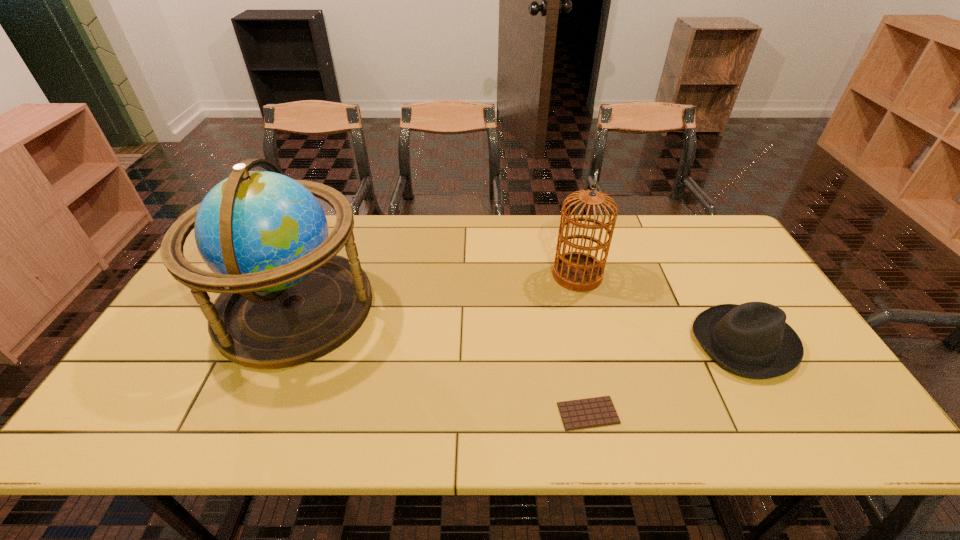
This screenshot has height=540, width=960. Identify the location of the leftmost object. (286, 298).

Locate an element on the screen. The width and height of the screenshot is (960, 540). the tallest object is located at coordinates (286, 298).

In order to click on the third shortest object in this screenshot , I will do `click(577, 271)`.

Identify the location of the third tallest object. This screenshot has height=540, width=960. (752, 339).

Locate an element on the screen. Image resolution: width=960 pixels, height=540 pixels. fedora is located at coordinates tap(752, 339).

At what (x,y) coordinates should I click in order to perform the action: click on the nearest object. Please return your answer as a coordinate pair (x, y). Looking at the image, I should click on (599, 411).

Where is `chocolate bar`? Image resolution: width=960 pixels, height=540 pixels. chocolate bar is located at coordinates (599, 411).

Locate an element on the screen. The height and width of the screenshot is (540, 960). vacant space located 0.240m on the back of the globe is located at coordinates (334, 216).

This screenshot has width=960, height=540. Find the location of `free point located 0.110m on the front of the birdcage`. free point located 0.110m on the front of the birdcage is located at coordinates (588, 320).

This screenshot has width=960, height=540. In order to click on vacant area situated on the left of the fedora in this screenshot , I will do `click(615, 343)`.